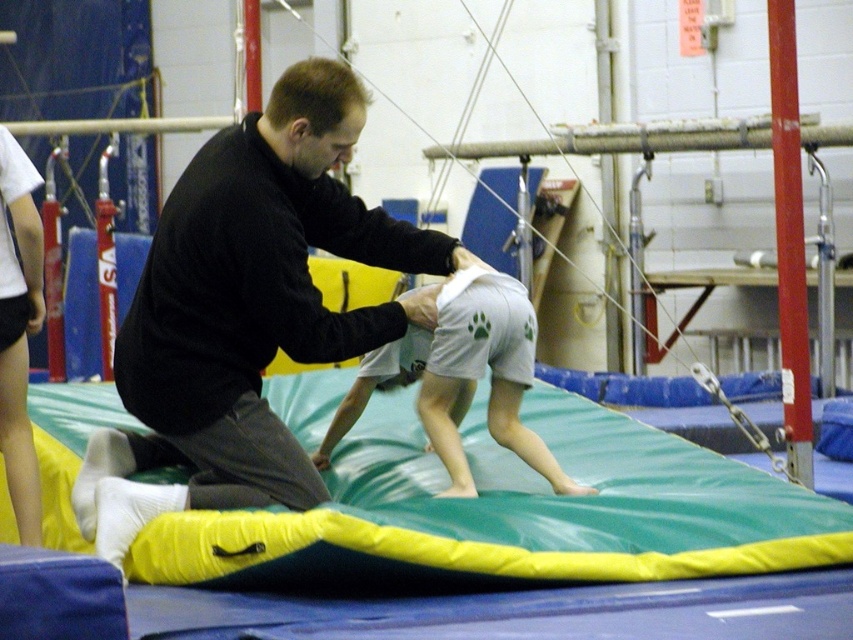
Does green foam mat at center have a greater width compared to black matte shirt at center?

Indeed, green foam mat at center has a greater width compared to black matte shirt at center.

Can you confirm if green foam mat at center is positioned to the left of black matte shirt at center?

In fact, green foam mat at center is to the right of black matte shirt at center.

Where is `green foam mat at center`? The image size is (853, 640). green foam mat at center is located at coordinates (505, 515).

Looking at this image, is green foam mat at center below white cotton shorts at center?

Indeed, green foam mat at center is positioned under white cotton shorts at center.

Consider the image. Which is more to the right, green foam mat at center or white cotton shorts at center?

green foam mat at center

Find the location of a particular element. green foam mat at center is located at coordinates (505, 515).

Does black matte shirt at center have a larger size compared to white cotton shorts at center?

Yes, black matte shirt at center is bigger than white cotton shorts at center.

Who is more forward, (271, 268) or (492, 282)?

Point (271, 268)

Where is `black matte shirt at center`? This screenshot has height=640, width=853. black matte shirt at center is located at coordinates (247, 310).